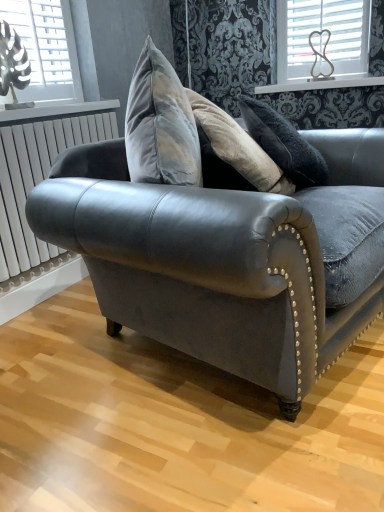
At what (x,y) coordinates should I click in order to perform the action: click on velvet dark gray couch at center. Please return your answer as a coordinate pair (x, y). This screenshot has width=384, height=512. Looking at the image, I should click on (222, 244).

Image resolution: width=384 pixels, height=512 pixels. Identify the location of metallic silver window at upper left, which is counted as the second window, starting from the right. pyautogui.click(x=46, y=48).

What do you see at coordinates (321, 84) in the screenshot? The height and width of the screenshot is (512, 384). I see `white glossy window sill at upper center` at bounding box center [321, 84].

Identify the location of white metallic radiator at left. (36, 182).

Consider the image. Does metallic silver window at upper left, the 1th window in the front-to-back sequence, have a lesser height compared to white glossy window sill at upper center?

No.

How much distance is there between metallic silver window at upper left, the 1th window in the front-to-back sequence, and white glossy window sill at upper center?

4.30 feet.

From the image's perspective, is metallic silver window at upper left, the 1th window in the front-to-back sequence, under white glossy window sill at upper center?

No, from the image's perspective, metallic silver window at upper left, the 1th window in the front-to-back sequence, is not beneath white glossy window sill at upper center.

Is metallic silver window at upper left, which is the first window in left-to-right order, turned away from white glossy window sill at upper center?

That's not correct — metallic silver window at upper left, which is the first window in left-to-right order, is not looking away from white glossy window sill at upper center.

Who is bigger, velvet dark gray couch at center or white plastic heart at upper right, which appears as the first window when viewed from the right?

velvet dark gray couch at center is bigger.

From the image's perspective, is velvet dark gray couch at center under white plastic heart at upper right, which appears as the first window when viewed from the back?

Indeed, from the image's perspective, velvet dark gray couch at center is shown beneath white plastic heart at upper right, which appears as the first window when viewed from the back.

Would you say velvet dark gray couch at center is inside or outside white plastic heart at upper right, which is the second window in front-to-back order?

velvet dark gray couch at center is spatially situated outside white plastic heart at upper right, which is the second window in front-to-back order.

Is point (106, 286) more distant than point (355, 11)?

No, (106, 286) is in front of (355, 11).

From the image's perspective, which object appears higher, velvet dark gray couch at center or white glossy window sill at upper center?

white glossy window sill at upper center.

Are velvet dark gray couch at center and white glossy window sill at upper center beside each other?

velvet dark gray couch at center and white glossy window sill at upper center are not in contact.

Considering the sizes of objects velvet dark gray couch at center and white glossy window sill at upper center in the image provided, who is bigger, velvet dark gray couch at center or white glossy window sill at upper center?

Bigger between the two is velvet dark gray couch at center.

You are a GUI agent. You are given a task and a screenshot of the screen. Output one action in this format:
    pyautogui.click(x=<x>, y=<y>)
    Task: Click on the studio couch located below the white glossy window sill at upper center (from the image's perspective)
    
    Given the screenshot: What is the action you would take?
    pyautogui.click(x=222, y=244)

From a real-world perspective, which object stands above the other?

metallic silver window at upper left, which is counted as the second window, starting from the right, is physically above.

Is velvet dark gray couch at center positioned in front of metallic silver window at upper left, which is the first window in left-to-right order?

Yes.

Which object is positioned more to the left, velvet dark gray couch at center or metallic silver window at upper left, which is the first window in left-to-right order?

Positioned to the left is metallic silver window at upper left, which is the first window in left-to-right order.

Could you measure the distance between velvet dark gray couch at center and metallic silver window at upper left, the 1th window in the front-to-back sequence?

velvet dark gray couch at center is 1.12 meters away from metallic silver window at upper left, the 1th window in the front-to-back sequence.

In order to click on radiator that is above the velvet dark gray couch at center (from a real-world perspective) in this screenshot , I will do `click(36, 182)`.

From a real-world perspective, is velvet dark gray couch at center under white metallic radiator at left?

Correct, in the physical world, velvet dark gray couch at center is lower than white metallic radiator at left.

Who is shorter, velvet dark gray couch at center or white metallic radiator at left?

With less height is white metallic radiator at left.

How many degrees apart are the facing directions of velvet dark gray couch at center and white metallic radiator at left?

The angle between the facing direction of velvet dark gray couch at center and the facing direction of white metallic radiator at left is 12.7 degrees.

Is point (320, 53) in front of point (346, 81)?

No, it is behind (346, 81).

Is the surface of white plastic heart at upper right, which appears as the first window when viewed from the back, in direct contact with white glossy window sill at upper center?

There is a gap between white plastic heart at upper right, which appears as the first window when viewed from the back, and white glossy window sill at upper center.

Is white glossy window sill at upper center at the back of white plastic heart at upper right, which appears as the first window when viewed from the back?

No, white glossy window sill at upper center is not at the back of white plastic heart at upper right, which appears as the first window when viewed from the back.

Identify the location of window sill in front of the white plastic heart at upper right, which is the second window in front-to-back order. The image size is (384, 512). (321, 84).

Are metallic silver window at upper left, which is the 2th window from back to front, and white metallic radiator at left beside each other?

No, metallic silver window at upper left, which is the 2th window from back to front, is not in contact with white metallic radiator at left.

From a real-world perspective, is metallic silver window at upper left, which is counted as the second window, starting from the right, above or below white metallic radiator at left?

From a real-world perspective, metallic silver window at upper left, which is counted as the second window, starting from the right, is physically above white metallic radiator at left.

Consider the image. How different are the orientations of metallic silver window at upper left, the 1th window in the front-to-back sequence, and white metallic radiator at left in degrees?

The angle between the facing direction of metallic silver window at upper left, the 1th window in the front-to-back sequence, and the facing direction of white metallic radiator at left is 0.00228 degrees.

Is white metallic radiator at left a part of metallic silver window at upper left, the 1th window in the front-to-back sequence?

No, white metallic radiator at left is not surrounded by metallic silver window at upper left, the 1th window in the front-to-back sequence.

Locate an element on the screen. The width and height of the screenshot is (384, 512). window sill behind the metallic silver window at upper left, which is counted as the second window, starting from the right is located at coordinates (321, 84).

Locate an element on the screen. This screenshot has height=512, width=384. studio couch on the left of white plastic heart at upper right, which is counted as the second window, starting from the left is located at coordinates (222, 244).

Looking at the image, which one is located closer to velvet dark gray couch at center, metallic silver window at upper left, which is the first window in left-to-right order, or white metallic radiator at left?

white metallic radiator at left is closer to velvet dark gray couch at center.

Estimate the real-world distances between objects in this image. Which object is further from white glossy window sill at upper center, white metallic radiator at left or metallic silver window at upper left, which is counted as the second window, starting from the right?

white metallic radiator at left lies further to white glossy window sill at upper center than the other object.

Looking at the image, which one is located further to white plastic heart at upper right, which is counted as the second window, starting from the left, white metallic radiator at left or velvet dark gray couch at center?

white metallic radiator at left is positioned further to the anchor white plastic heart at upper right, which is counted as the second window, starting from the left.

Based on their spatial positions, is metallic silver window at upper left, the 1th window in the front-to-back sequence, or white glossy window sill at upper center further from white metallic radiator at left?

white glossy window sill at upper center.

In the scene shown: Looking at the image, which one is located further to metallic silver window at upper left, the 1th window in the front-to-back sequence, velvet dark gray couch at center or white plastic heart at upper right, which is counted as the second window, starting from the left?

Based on the image, white plastic heart at upper right, which is counted as the second window, starting from the left, appears to be further to metallic silver window at upper left, the 1th window in the front-to-back sequence.

From the image, which object appears to be nearer to white glossy window sill at upper center, white metallic radiator at left or velvet dark gray couch at center?

white metallic radiator at left.

Which object lies further to the anchor point white glossy window sill at upper center, metallic silver window at upper left, which is counted as the second window, starting from the right, or velvet dark gray couch at center?

velvet dark gray couch at center is further to white glossy window sill at upper center.

Based on their spatial positions, is white plastic heart at upper right, which appears as the first window when viewed from the right, or metallic silver window at upper left, which is counted as the second window, starting from the right, further from white metallic radiator at left?

The object further to white metallic radiator at left is white plastic heart at upper right, which appears as the first window when viewed from the right.

You are a GUI agent. You are given a task and a screenshot of the screen. Output one action in this format:
    pyautogui.click(x=<x>, y=<y>)
    Task: Click on the radiator between metallic silver window at upper left, which is the first window in left-to-right order, and white glossy window sill at upper center, in the horizontal direction
    
    Given the screenshot: What is the action you would take?
    pyautogui.click(x=36, y=182)

Locate an element on the screen. radiator between metallic silver window at upper left, which is the 2th window from back to front, and velvet dark gray couch at center from left to right is located at coordinates (36, 182).

Locate an element on the screen. This screenshot has width=384, height=512. window sill located between white metallic radiator at left and white plastic heart at upper right, which appears as the first window when viewed from the back, in the left-right direction is located at coordinates (321, 84).

You are a GUI agent. You are given a task and a screenshot of the screen. Output one action in this format:
    pyautogui.click(x=<x>, y=<y>)
    Task: Click on the window sill situated between metallic silver window at upper left, which is the first window in left-to-right order, and white plastic heart at upper right, which appears as the first window when viewed from the right, from left to right
    
    Given the screenshot: What is the action you would take?
    pyautogui.click(x=321, y=84)